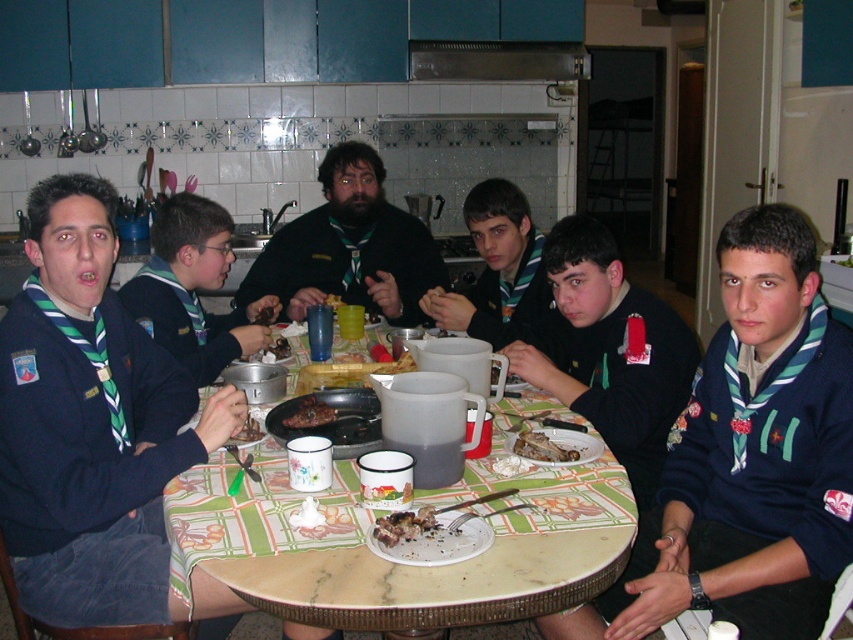
Question: Which point appears farthest from the camera in this image?

Choices:
 (A) (204, 273)
 (B) (329, 305)
 (C) (521, 48)

Answer: (C)

Question: Is black matte shirt at center closer to camera compared to brushed metal exhaust hood at upper center?

Choices:
 (A) no
 (B) yes

Answer: (B)

Question: Among these objects, which one is farthest from the camera?

Choices:
 (A) brown crispy bread at table center
 (B) yellow matte plastic cup at center
 (C) black matte shirt at center

Answer: (C)

Question: Which point appears closest to the camera in this image?

Choices:
 (A) (265, 352)
 (B) (380, 531)

Answer: (B)

Question: Observing the image, what is the correct spatial positioning of crumbly brown bread at table center in reference to brown crispy meat at center?

Choices:
 (A) left
 (B) right

Answer: (B)

Question: In this image, where is crumbly brown bread at table center located relative to yellow matte plastic cup at center?

Choices:
 (A) below
 (B) above

Answer: (A)